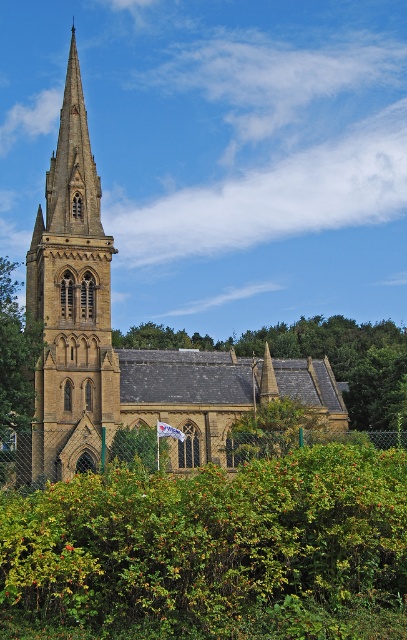
You are standing in front of the golden stone church at center and the brown stone tower at left. Which structure is closer to you?

The golden stone church at center is closer to you because it is in front of the brown stone tower at left.

You are standing in front of the golden stone church at center and want to take a photo of the flagpole. The green leafy bush at center might block your view. Which object is taller and could potentially block the flagpole from view?

The golden stone church at center is taller than the green leafy bush at center, so the church itself might block the view of the flagpole rather than the bush.

You are a visitor standing in front of the church and want to take a photo that includes both the green leafy tree at center and the green leafy tree at left. Which tree should you position closer to the camera to ensure both are fully visible in the frame?

To ensure both the green leafy tree at center and the green leafy tree at left are fully visible in the frame, you should position the green leafy tree at center closer to the camera since it is shorter than the green leafy tree at left.